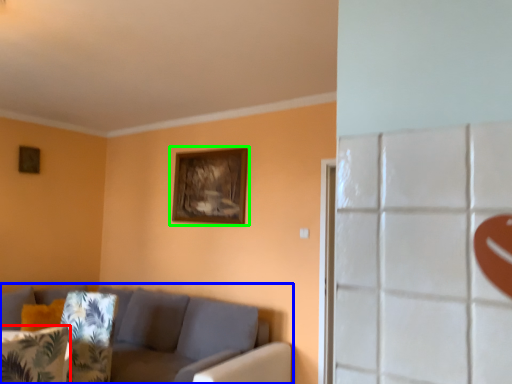
Question: Considering the real-world distances, which object is closest to pillow (highlighted by a red box)? studio couch (highlighted by a blue box) or picture frame (highlighted by a green box).

Choices:
 (A) studio couch
 (B) picture frame

Answer: (A)